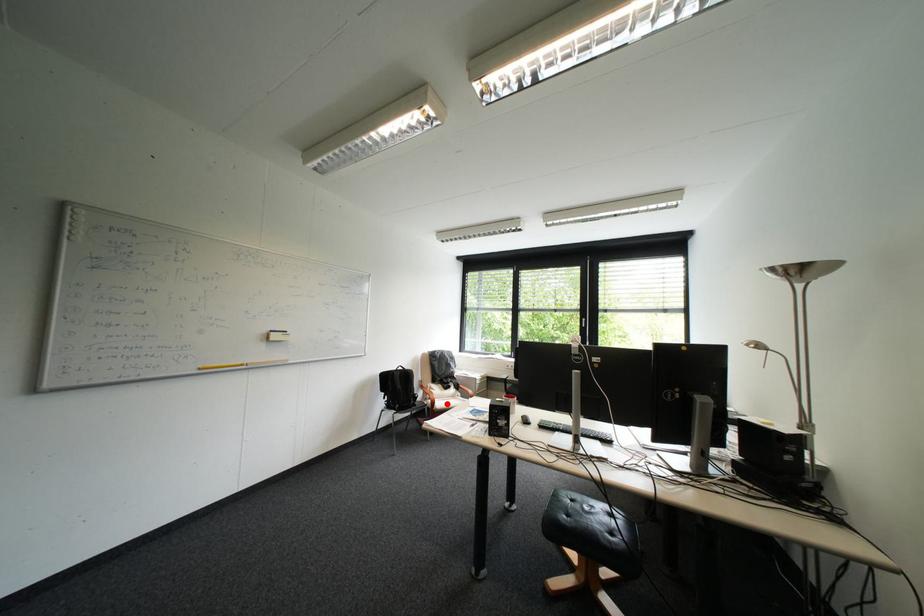
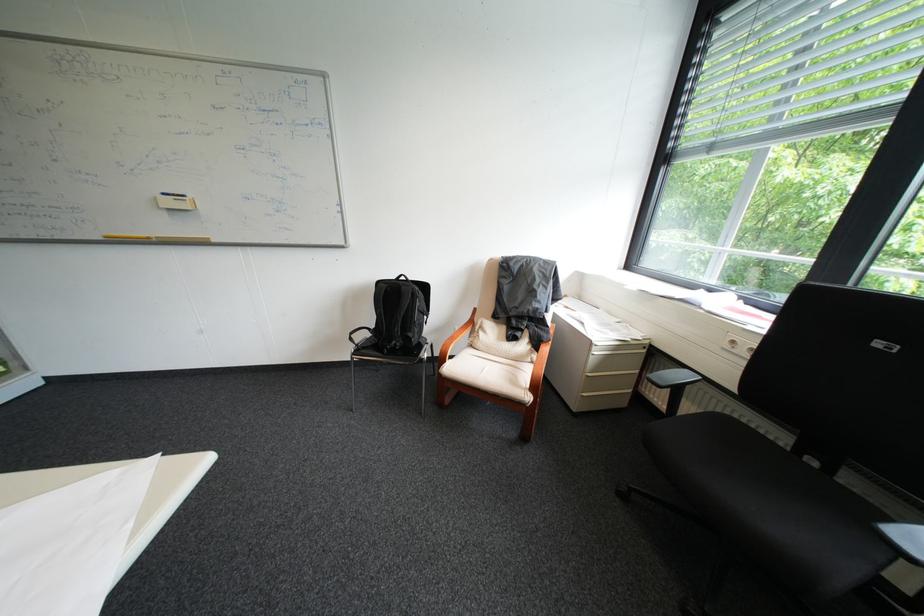
Question: I am providing you with two images of the same scene from different viewpoints. Given a red point in image1, look at the same physical point in image2. Is it:

Choices:
 (A) Closer to the viewpoint
 (B) Farther from the viewpoint

Answer: (A)